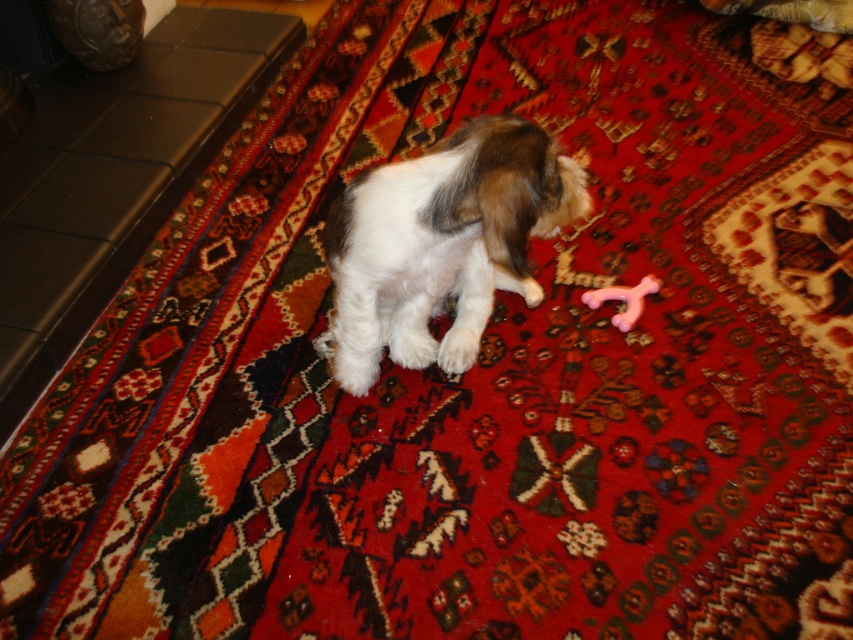
Is the position of white fluffy dog at center less distant than that of pink rubber toy at center?

Yes, white fluffy dog at center is closer to the viewer.

Who is positioned more to the left, white fluffy dog at center or pink rubber toy at center?

From the viewer's perspective, white fluffy dog at center appears more on the left side.

Describe the element at coordinates (440, 244) in the screenshot. I see `white fluffy dog at center` at that location.

This screenshot has height=640, width=853. Identify the location of white fluffy dog at center. (440, 244).